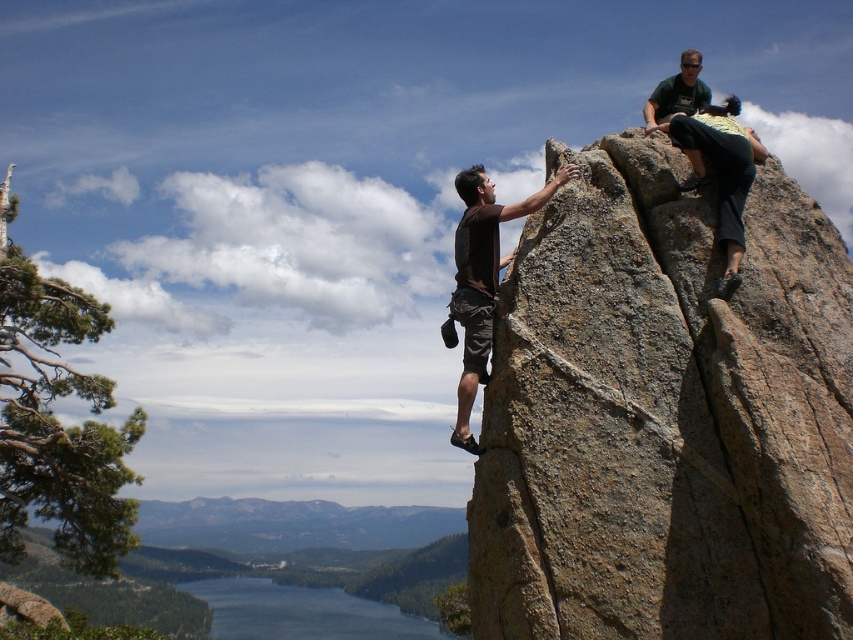
You are a hiker who wants to cross from the brown rock at upper right to the blue glassy water at lower left. Given that the distance between them is 125.24 meters, can you estimate how long it would take you to walk straight there at a normal walking pace of 5 km per hour?

The distance between the brown rock at upper right and the blue glassy water at lower left is 125.24 meters. At a normal walking pace of 5 km per hour, it would take approximately 1.5 minutes to walk straight there.

You are a photographer planning to capture the climbers on the brown rock at upper right and the blue glassy water at lower left in a single shot. Based on their sizes, which object should you focus on first to ensure both are in frame?

The brown rock at upper right is bigger than the blue glassy water at lower left, so you should focus on the brown rock at upper right first to ensure both are in frame since it takes up more space.

You are a climber trying to reach the top of the brown rock at upper right. You see the blue glassy water at lower left below you. Which direction should you move to ascend higher?

The brown rock at upper right is above the blue glassy water at lower left, so to ascend higher, you should move towards the upper right direction away from the blue glassy water at lower left.